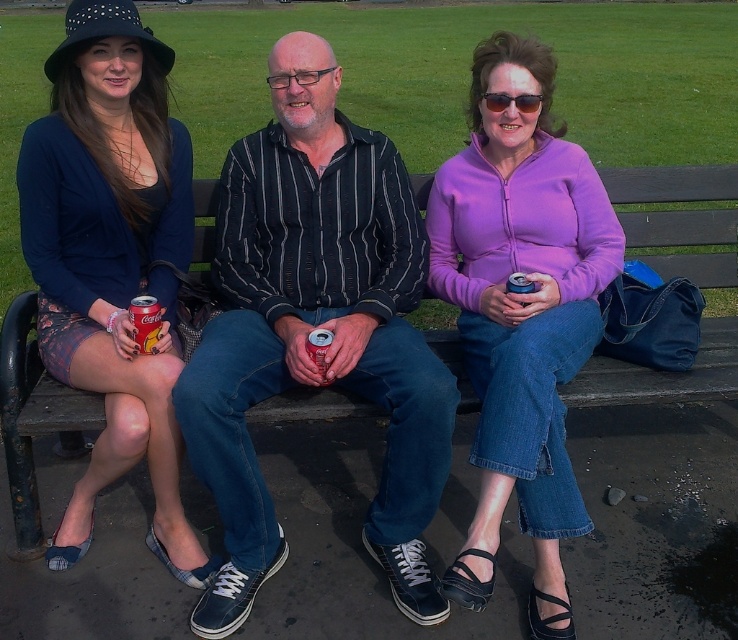
Does purple fleece jacket at center have a greater height compared to matte black hat at upper left?

Indeed, purple fleece jacket at center has a greater height compared to matte black hat at upper left.

Is purple fleece jacket at center further to the viewer compared to matte black hat at upper left?

No, purple fleece jacket at center is in front of matte black hat at upper left.

Who is more forward, (542,282) or (46,65)?

Point (46,65) is more forward.

The height and width of the screenshot is (640, 738). I want to click on purple fleece jacket at center, so click(x=520, y=314).

Where is `purple fleece jacket at center`? purple fleece jacket at center is located at coordinates (520, 314).

The height and width of the screenshot is (640, 738). Describe the element at coordinates (520, 314) in the screenshot. I see `purple fleece jacket at center` at that location.

In order to click on purple fleece jacket at center in this screenshot , I will do click(x=520, y=314).

Which is more to the left, striped cotton shirt at center or matte red can at left?

matte red can at left

Does striped cotton shirt at center have a smaller size compared to matte red can at left?

Incorrect, striped cotton shirt at center is not smaller in size than matte red can at left.

Between point (300, 324) and point (139, 317), which one is positioned in front?

Point (139, 317) is in front.

This screenshot has height=640, width=738. Find the location of `striped cotton shirt at center`. striped cotton shirt at center is located at coordinates (314, 328).